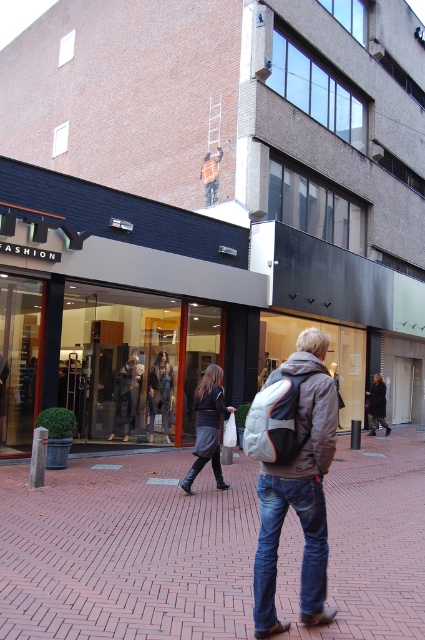
You are a window shopper standing on the street in front of the ITY ASHION store. You notice the matte black glass mall at center and the blue denim jeans at lower right. Which object takes up more space in the scene?

The matte black glass mall at center takes up more space in the scene because it is bigger than the blue denim jeans at lower right.

You are standing on the street in front of the ITY ASHION store and see both the dark gray skirt at center and the dark gray wool coat at center displayed in the window. Which item is positioned closer to the front of the store window?

The dark gray skirt at center is closer to the viewer than the dark gray wool coat at center, so the dark gray skirt at center is positioned closer to the front of the store window.